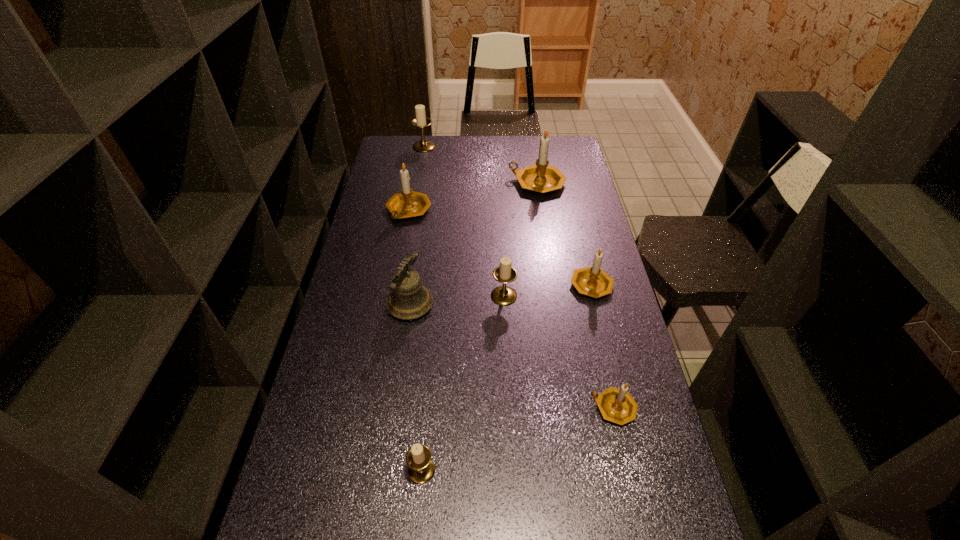
This screenshot has width=960, height=540. Identify the location of the second nearest object. (x=616, y=405).

What are the coordinates of `the nearest object` in the screenshot? It's located at (421, 469).

Locate an element on the screen. Image resolution: width=960 pixels, height=540 pixels. the second white candle holder from left to right is located at coordinates pyautogui.click(x=421, y=469).

The width and height of the screenshot is (960, 540). In order to click on free space located on the front of the tallest object in this screenshot , I will do `click(550, 266)`.

Image resolution: width=960 pixels, height=540 pixels. I want to click on free region located on the right of the second biggest gold candle holder, so click(x=482, y=211).

Image resolution: width=960 pixels, height=540 pixels. In order to click on blank area located 0.380m on the right of the biggest white candle holder in this screenshot , I will do `click(516, 147)`.

The image size is (960, 540). Identify the location of vacant region located on the right of the bell. (518, 305).

Locate an element on the screen. The width and height of the screenshot is (960, 540). vacant region located 0.220m on the back of the second nearest gold candle holder is located at coordinates (578, 226).

The image size is (960, 540). What are the coordinates of `vacant area situated 0.310m on the left of the second smallest white candle holder` in the screenshot? It's located at (396, 296).

Image resolution: width=960 pixels, height=540 pixels. I want to click on vacant area located on the back of the sixth farthest candle holder, so click(x=603, y=361).